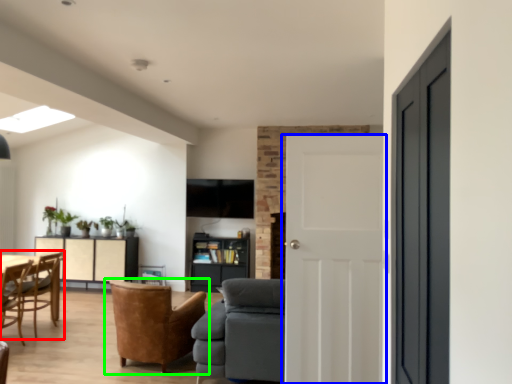
Question: Based on their relative distances, which object is farther from chair (highlighted by a red box)? Choose from door (highlighted by a blue box) and chair (highlighted by a green box).

Choices:
 (A) door
 (B) chair

Answer: (A)